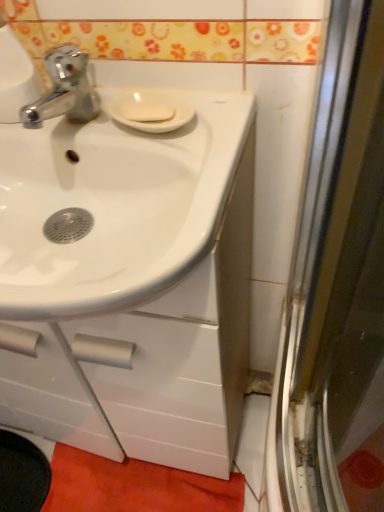
Question: From the image's perspective, is orange fabric bath mat at lower center beneath white glossy sink at center?

Choices:
 (A) no
 (B) yes

Answer: (B)

Question: Is orange fabric bath mat at lower center facing towards white glossy sink at center?

Choices:
 (A) yes
 (B) no

Answer: (B)

Question: Can you confirm if orange fabric bath mat at lower center is shorter than white glossy sink at center?

Choices:
 (A) yes
 (B) no

Answer: (A)

Question: Is orange fabric bath mat at lower center not near white glossy sink at center?

Choices:
 (A) no
 (B) yes

Answer: (A)

Question: Is orange fabric bath mat at lower center wider than white glossy sink at center?

Choices:
 (A) no
 (B) yes

Answer: (A)

Question: Is orange fabric bath mat at lower center touching white glossy sink at center?

Choices:
 (A) yes
 (B) no

Answer: (B)

Question: Considering the relative sizes of white matte soap at center and orange fabric bath mat at lower center in the image provided, is white matte soap at center wider than orange fabric bath mat at lower center?

Choices:
 (A) no
 (B) yes

Answer: (A)

Question: Is white matte soap at center oriented away from orange fabric bath mat at lower center?

Choices:
 (A) no
 (B) yes

Answer: (A)

Question: Can we say white matte soap at center lies outside orange fabric bath mat at lower center?

Choices:
 (A) yes
 (B) no

Answer: (A)

Question: Is white matte soap at center shorter than orange fabric bath mat at lower center?

Choices:
 (A) yes
 (B) no

Answer: (A)

Question: Is white matte soap at center surrounding orange fabric bath mat at lower center?

Choices:
 (A) yes
 (B) no

Answer: (B)

Question: Could you tell me if white matte soap at center is turned towards orange fabric bath mat at lower center?

Choices:
 (A) yes
 (B) no

Answer: (B)

Question: Would you say white glossy sink at center is outside white matte soap at center?

Choices:
 (A) no
 (B) yes

Answer: (B)